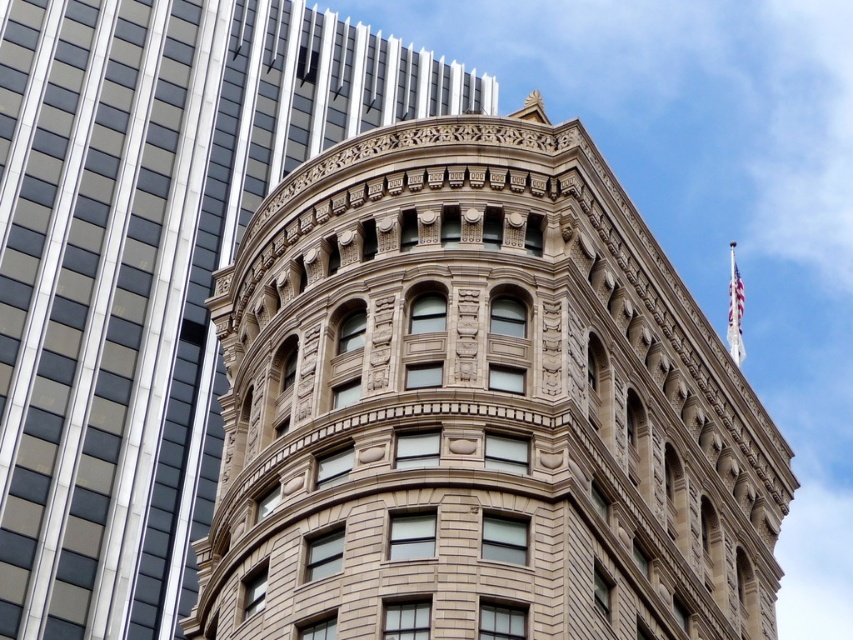
You are an architect analyzing the image of two brown stone structures. You need to determine which one is narrower between the brown stone tower at center and the brown stone building at center. Which one is narrower?

The brown stone tower at center is narrower than the brown stone building at center because it has a lesser width compared to the brown stone building at center.

You are standing in front of the modern skyscraper on the left and want to walk to the historic building on the right. There are two points marked on the ground, point A at coordinates point A is point (531, 120) and point B at coordinates point B is point (202, 289). Which point is closer to you as you face the buildings?

Point A at coordinates point A is point (531, 120) is closer to you because it is in front of point B at coordinates point B is point (202, 289).

You are standing at the origin point in the image. Which direction should you move to reach the brown stone tower at center?

The brown stone tower at center is located at coordinates approximately 0.639 on the x axis and 0.562 on the y axis. Since you are at the origin, you should move towards the positive x and positive y direction to reach it.